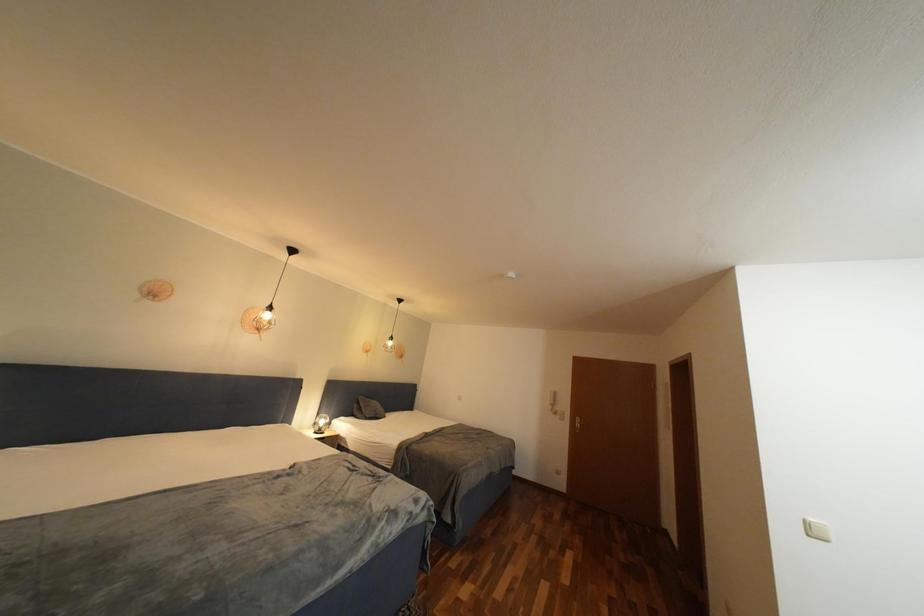
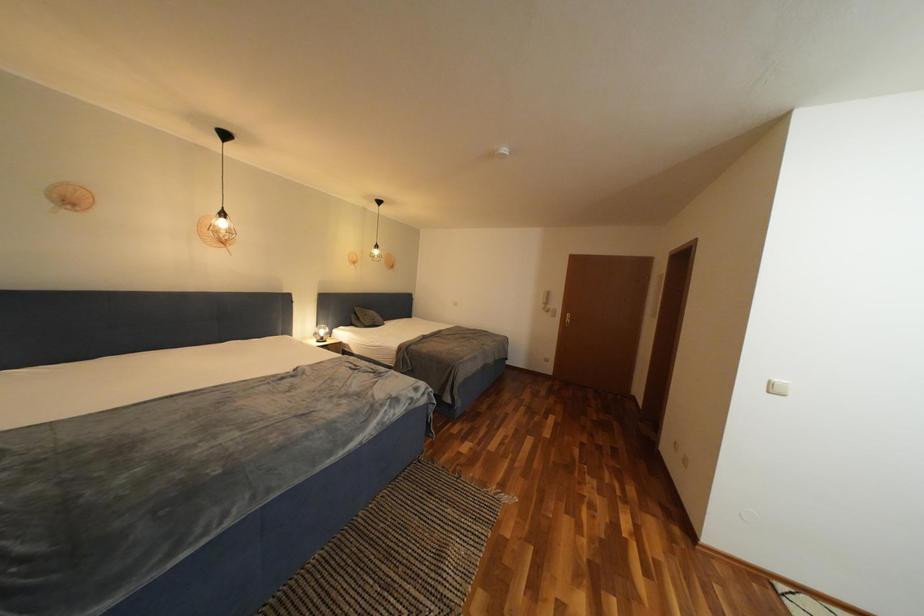
The images are taken continuously from a first-person perspective. In which direction are you moving?

The movement direction of the cameraman is right, forward.